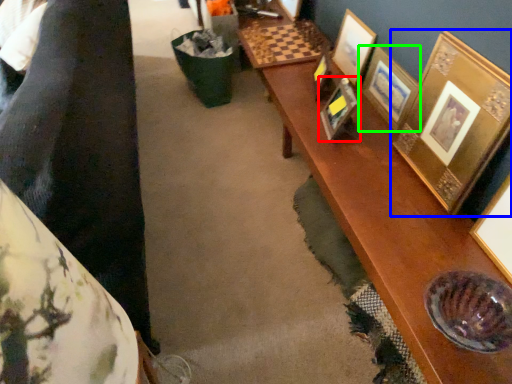
Question: Which is farther away from picture frame (highlighted by a red box)? picture frame (highlighted by a blue box) or picture frame (highlighted by a green box)?

Choices:
 (A) picture frame
 (B) picture frame

Answer: (A)